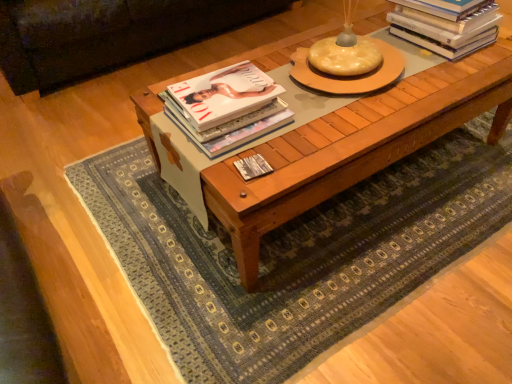
The image size is (512, 384). Identify the location of vacant area to the left of white glossy book at center, placed as the 2th book when sorted from left to right. (212, 170).